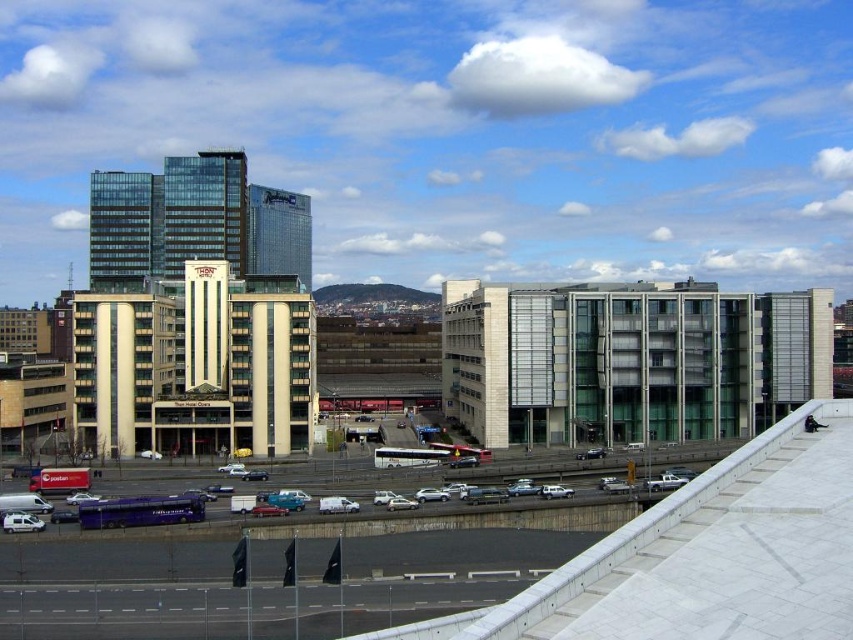
You are a city planner analyzing traffic flow. Given the coordinates of the matte blue bus at center, which part of the image should you focus on to assess its position relative to the flagpoles and roadway?

The matte blue bus at center is located at coordinates point [438,516], so you should focus on the center area of the image to assess its position relative to the flagpoles and roadway.

You are a pedestrian standing at the edge of the roadway. You need to cross the road to reach the row of flagpoles. There is a matte blue bus at center and a white matte van at lower left. Which vehicle should you avoid stepping in front of while crossing?

You should avoid stepping in front of the matte blue bus at center because it is positioned to the right of the white matte van at lower left, meaning it is farther away from your current position at the edge of the roadway. However, always ensure vehicles are completely stopped before crossing.

You are a pedestrian standing on the sidewalk near the flagpoles. You need to cross the roadway to reach the buildings. Which vehicle, the matte blue bus at center or the white matte car at center, should you wait for first to ensure safety?

You should wait for the matte blue bus at center first because it is larger in size than the white matte car at center, making it potentially more dangerous if not given proper attention.